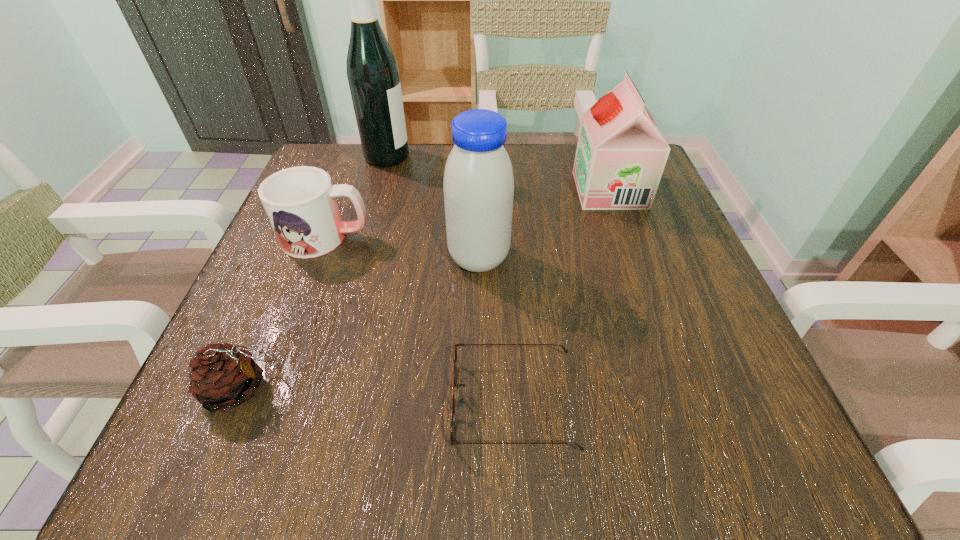
Locate an element on the screen. This screenshot has width=960, height=540. free spot between the tallest object and the taller soya milk is located at coordinates (433, 207).

At what (x,y) coordinates should I click in order to perform the action: click on the closest object to the sunglasses. Please return your answer as a coordinate pair (x, y). This screenshot has height=540, width=960. Looking at the image, I should click on (478, 184).

Select which object is the closest to the mug. Please provide its 2D coordinates. Your answer should be formatted as a tuple, i.e. [(x, y)], where the tuple contains the x and y coordinates of a point satisfying the conditions above.

[(478, 184)]

The width and height of the screenshot is (960, 540). I want to click on free space in the image that satisfies the following two spatial constraints: 1. on the side of the fourth tallest object with the handle; 2. on the right side of the taller soya milk, so click(318, 258).

This screenshot has height=540, width=960. I want to click on vacant position in the image that satisfies the following two spatial constraints: 1. with the cap open on the farther soya milk; 2. on the front side of the left soya milk, so click(x=634, y=258).